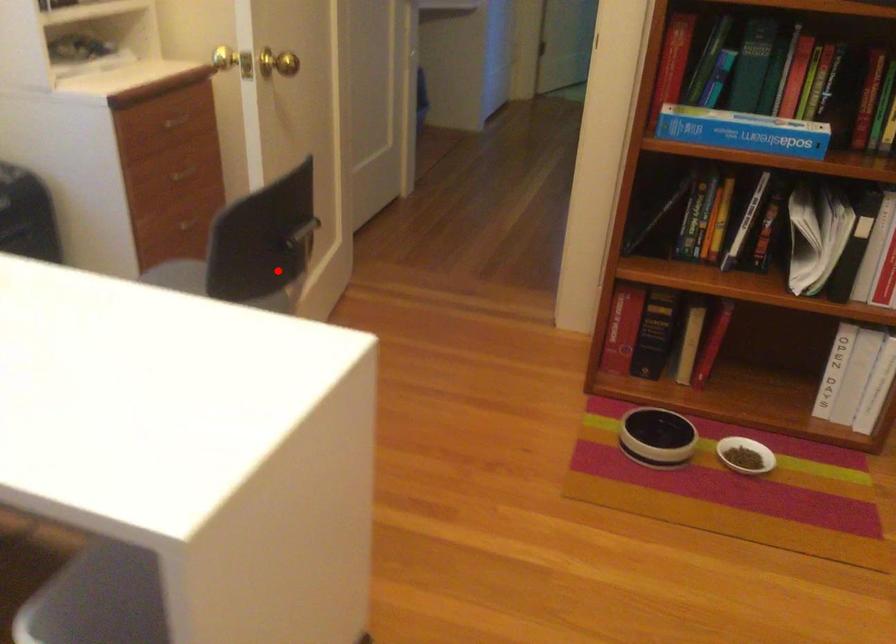
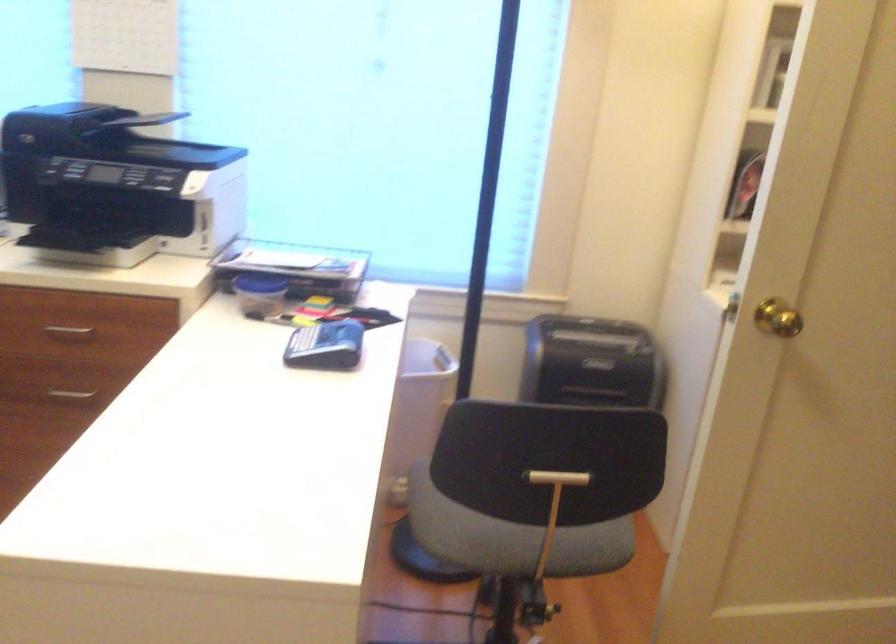
In the second image, find the point that corresponds to the highlighted location in the first image.

(535, 495)